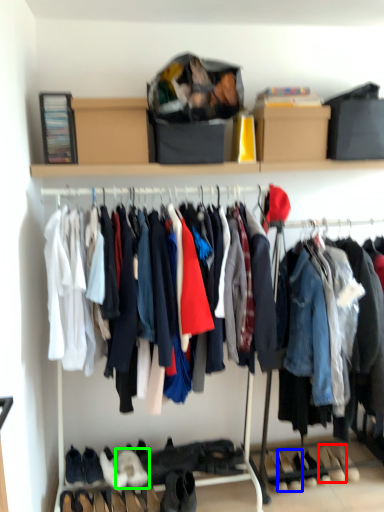
Question: Based on their relative distances, which object is nearer to footwear (highlighted by a red box)? Choose from footwear (highlighted by a blue box) and footwear (highlighted by a green box).

Choices:
 (A) footwear
 (B) footwear

Answer: (A)